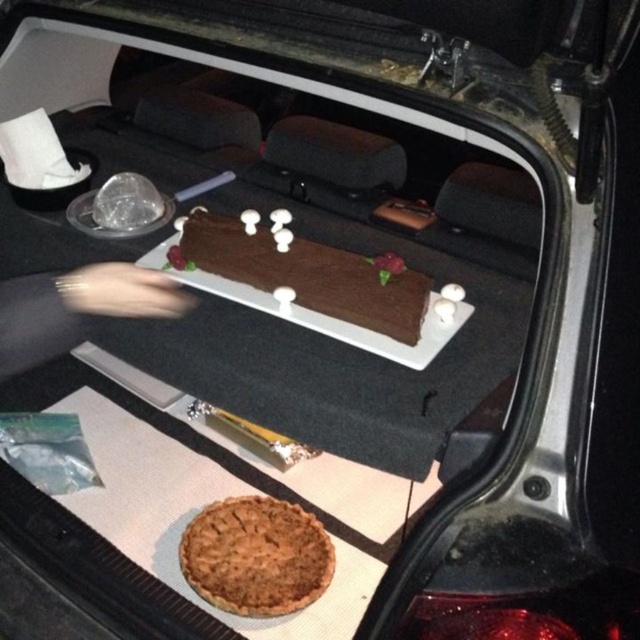
Question: Can you confirm if golden brown flaky pie at lower center is smaller than chocolate matte at center?

Choices:
 (A) yes
 (B) no

Answer: (A)

Question: Where is golden brown flaky pie at lower center located in relation to chocolate matte at center in the image?

Choices:
 (A) right
 (B) left

Answer: (B)

Question: Which point is farther from the camera taking this photo?

Choices:
 (A) (211, 556)
 (B) (346, 285)

Answer: (A)

Question: Which object appears farthest from the camera in this image?

Choices:
 (A) golden brown flaky pie at lower center
 (B) chocolate matte at center

Answer: (A)

Question: Which object is farther from the camera taking this photo?

Choices:
 (A) golden brown flaky pie at lower center
 (B) chocolate matte at center

Answer: (A)

Question: Can you confirm if golden brown flaky pie at lower center is wider than chocolate matte at center?

Choices:
 (A) no
 (B) yes

Answer: (A)